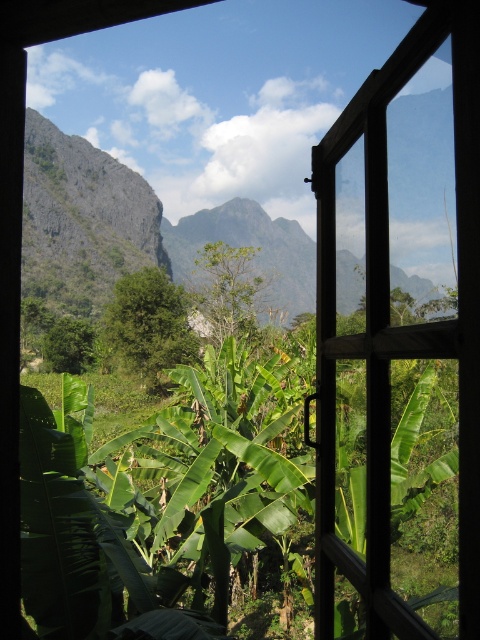
Question: From the image, what is the correct spatial relationship of wooden frame at center in relation to green leafy banana tree at center?

Choices:
 (A) right
 (B) left

Answer: (A)

Question: Is the position of wooden frame at center less distant than that of green leafy banana tree at center?

Choices:
 (A) yes
 (B) no

Answer: (A)

Question: Does wooden frame at center lie in front of green leafy banana tree at center?

Choices:
 (A) no
 (B) yes

Answer: (B)

Question: Which point is farther to the camera?

Choices:
 (A) green leafy banana tree at center
 (B) wooden frame at center

Answer: (A)

Question: Which point is closer to the camera taking this photo?

Choices:
 (A) (442, 344)
 (B) (301, 500)

Answer: (A)